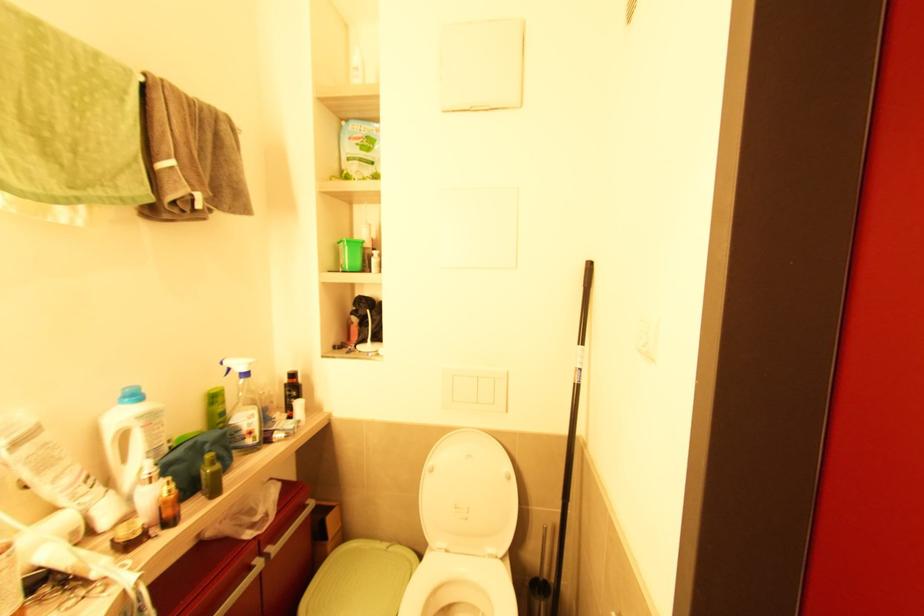
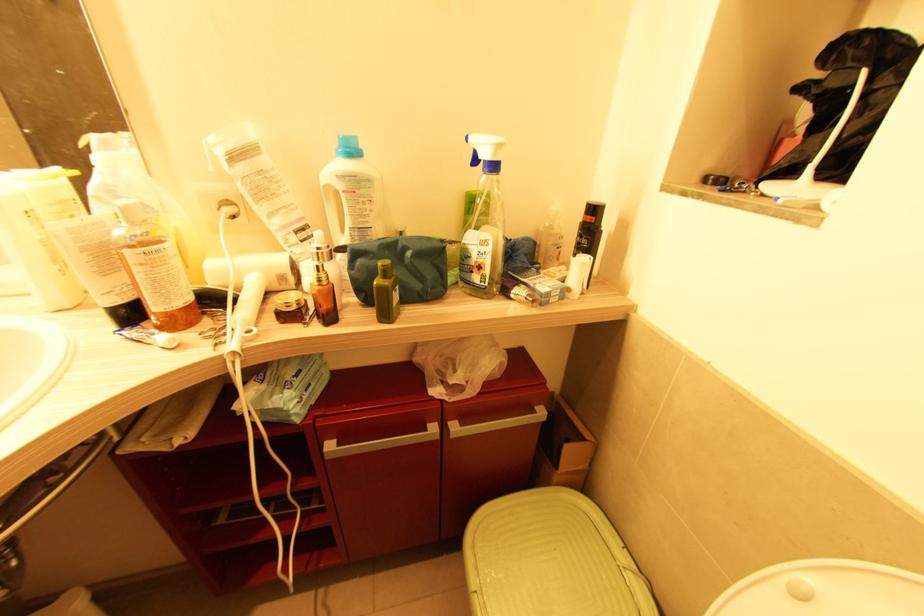
Locate, in the second image, the point that corresponds to pixel 127 399 in the first image.

(341, 148)